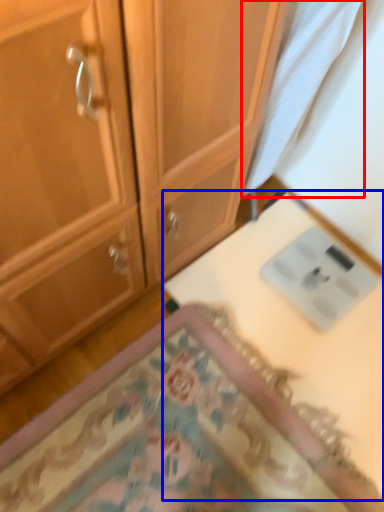
Question: Among these objects, which one is farthest to the camera, fabric (highlighted by a red box) or table (highlighted by a blue box)?

Choices:
 (A) fabric
 (B) table

Answer: (B)